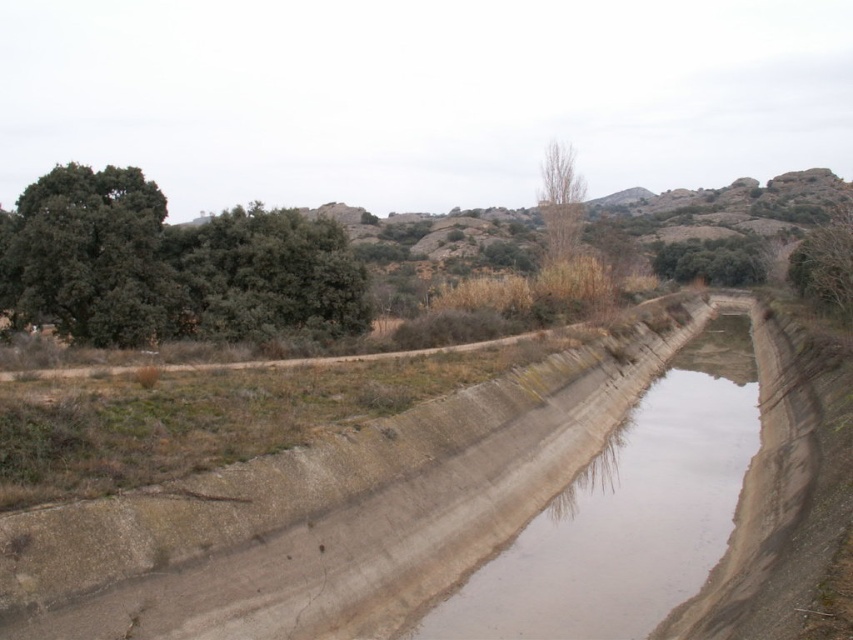
You are a hiker trying to determine the direction of the canal flow. You notice the green leafy tree at upper right and the bare wood tree at center. Which tree is closer to the starting point of the canal?

The green leafy tree at upper right is larger in size than the bare wood tree at center, but size does not indicate proximity to the canal starting point. Without additional information about their positions relative to the canal, it is impossible to determine which tree is closer to the starting point.

You are a hiker trying to navigate through the dry canal. You see the green matte tree at upper left and the green leafy tree at upper right in the distance. Which tree would you use as a landmark if you want to indicate the narrower part of the canal?

The green matte tree at upper left is smaller than the green leafy tree at upper right, so the narrower part of the canal is likely near the green matte tree at upper left since smaller trees might indicate less space.